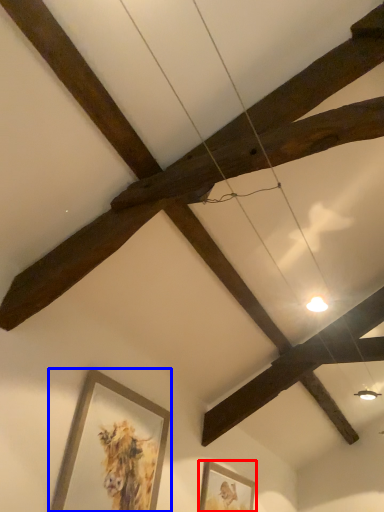
Question: Which object is closer to the camera taking this photo, picture frame (highlighted by a red box) or picture frame (highlighted by a blue box)?

Choices:
 (A) picture frame
 (B) picture frame

Answer: (B)